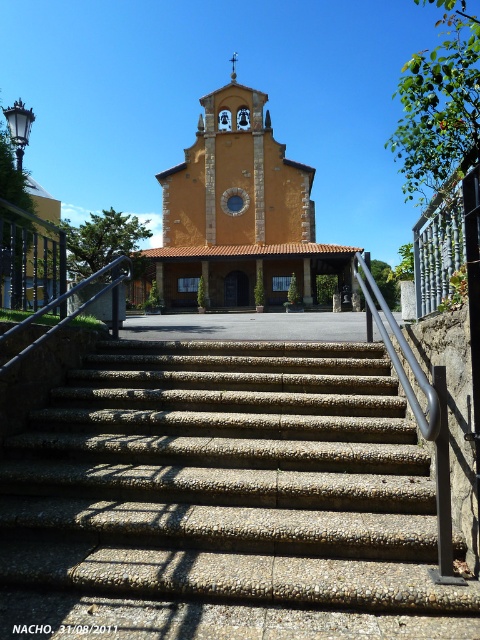
You are a maintenance worker assigned to check the condition of the concrete textured stairs at center and the silver metallic handrail at center. Which object would require more material if you were to replace it entirely?

The concrete textured stairs at center would require more material to replace since it is larger in size than the silver metallic handrail at center.